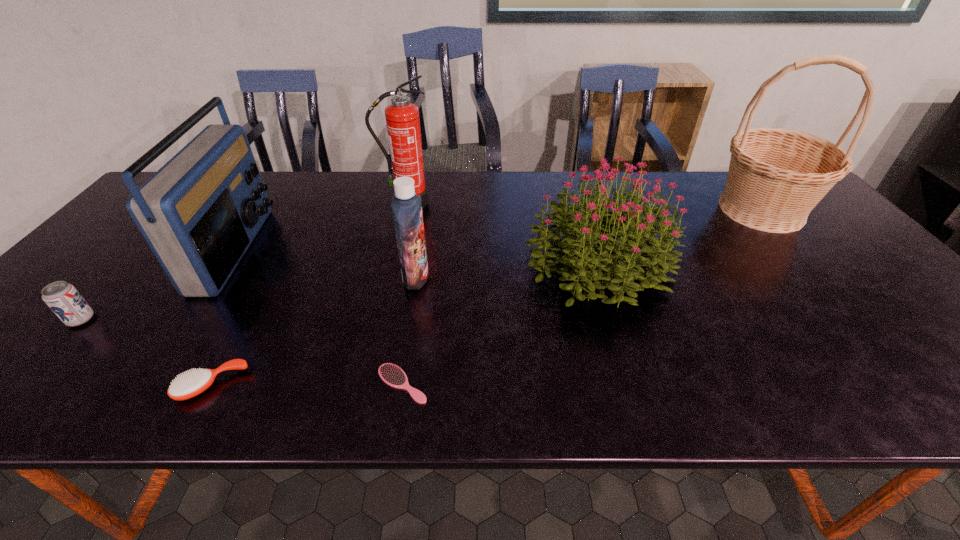
Locate an element on the screen. This screenshot has width=960, height=540. the shorter hairbrush is located at coordinates (392, 375).

Identify the location of vacant area located 0.290m on the front of the rightmost object. Image resolution: width=960 pixels, height=540 pixels. (852, 317).

I want to click on vacant area situated on the front-facing side of the fire extinguisher, so click(383, 302).

This screenshot has height=540, width=960. What are the coordinates of `free spot located 0.060m on the front panel of the second object from left to right` in the screenshot? It's located at (278, 249).

You are a GUI agent. You are given a task and a screenshot of the screen. Output one action in this format:
    pyautogui.click(x=<x>, y=<y>)
    Task: Click on the vacant space situated 0.130m on the right of the seventh object from left to right
    The height and width of the screenshot is (540, 960).
    Given the screenshot: What is the action you would take?
    pyautogui.click(x=723, y=265)

The image size is (960, 540). What are the coordinates of `free region located 0.340m on the front label of the shampoo` in the screenshot? It's located at (565, 277).

Find the location of a particular element. Image resolution: width=960 pixels, height=540 pixels. free space located 0.240m on the right of the beer can is located at coordinates (201, 320).

I want to click on free location located on the left of the taller hairbrush, so click(98, 384).

This screenshot has height=540, width=960. Find the location of `free spot located on the left of the right hairbrush`. free spot located on the left of the right hairbrush is located at coordinates (172, 383).

This screenshot has width=960, height=540. I want to click on basket situated at the far edge, so click(776, 176).